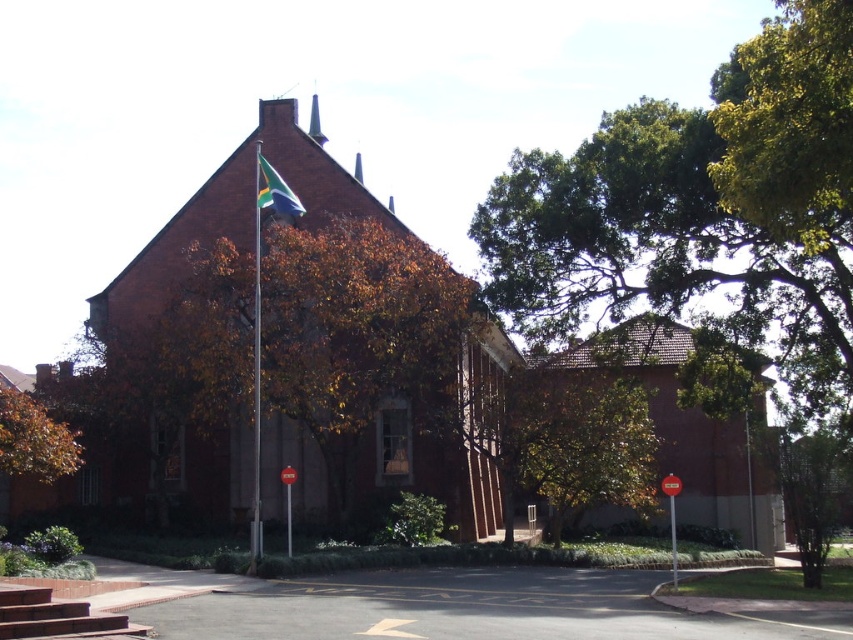
Describe the element at coordinates (579, 440) in the screenshot. I see `green leafy tree at center` at that location.

Between green leafy tree at center and blue-green fabric flag at upper center, which one appears on the left side from the viewer's perspective?

From the viewer's perspective, blue-green fabric flag at upper center appears more on the left side.

The image size is (853, 640). What do you see at coordinates (579, 440) in the screenshot? I see `green leafy tree at center` at bounding box center [579, 440].

Find the location of a particular element. The width and height of the screenshot is (853, 640). green leafy tree at center is located at coordinates (579, 440).

Is brown leafy tree at center above metallic flag pole at upper center?

Indeed, brown leafy tree at center is positioned over metallic flag pole at upper center.

Looking at this image, who is more distant from viewer, (x=396, y=264) or (x=254, y=292)?

The point (x=396, y=264) is behind.

At what (x,y) coordinates should I click in order to perform the action: click on brown leafy tree at center. Please return your answer as a coordinate pair (x, y). Looking at the image, I should click on (358, 332).

Does brown leafy tree at center lie in front of brown leafy tree at lower left?

No, it is not.

Is brown leafy tree at center to the left of brown leafy tree at lower left from the viewer's perspective?

In fact, brown leafy tree at center is to the right of brown leafy tree at lower left.

Identify the location of brown leafy tree at center. This screenshot has width=853, height=640. (358, 332).

You are a GUI agent. You are given a task and a screenshot of the screen. Output one action in this format:
    pyautogui.click(x=<x>, y=<y>)
    Task: Click on the brown leafy tree at center
    Image resolution: width=853 pixels, height=640 pixels.
    Given the screenshot: What is the action you would take?
    pyautogui.click(x=358, y=332)